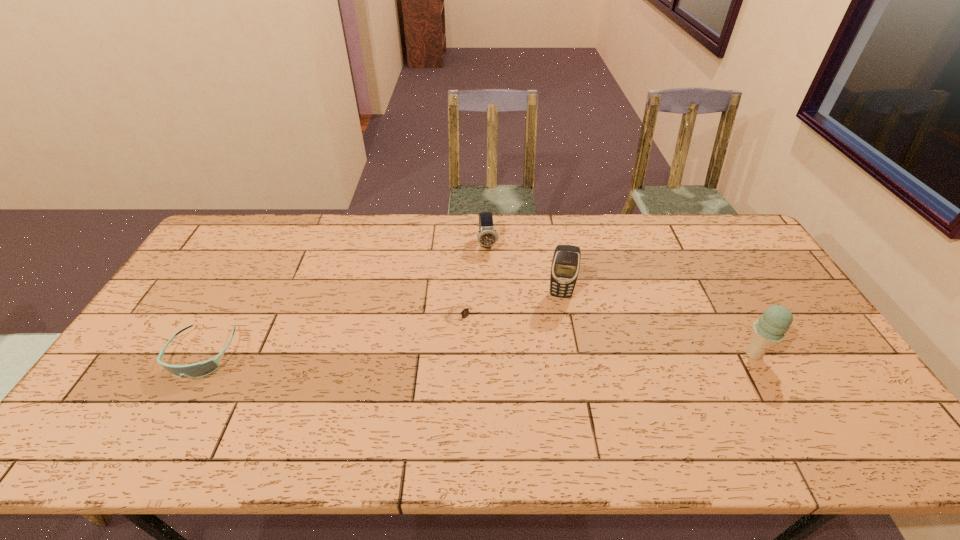
You are a GUI agent. You are given a task and a screenshot of the screen. Output one action in this format:
    pyautogui.click(x=<x>, y=<y>)
    Task: Click on the free space on the desktop that is between the goggles and the ice cream and is positioned on the face of the taller watch
    The height and width of the screenshot is (540, 960).
    Given the screenshot: What is the action you would take?
    pyautogui.click(x=505, y=354)

The image size is (960, 540). Identify the location of vacant space on the desktop that is between the second shortest object and the rightmost object and is positioned on the face of the shortest object. (516, 354).

The height and width of the screenshot is (540, 960). In order to click on vacant space on the desktop that is between the leftmost object and the ice cream and is positioned on the front face of the cellular telephone in this screenshot , I will do click(560, 354).